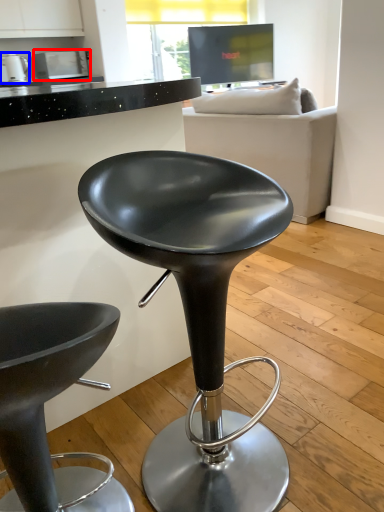
Question: Which object is further to the camera taking this photo, appliance (highlighted by a red box) or appliance (highlighted by a blue box)?

Choices:
 (A) appliance
 (B) appliance

Answer: (A)